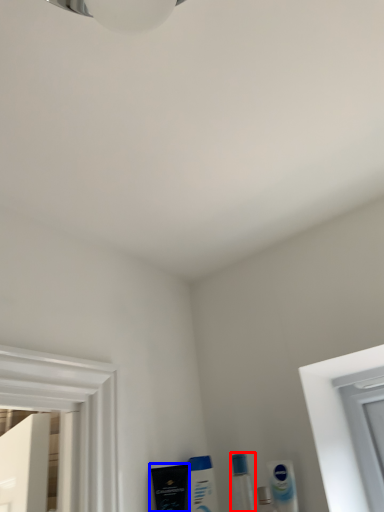
Question: Which object appears farthest to the camera in this image, toiletry (highlighted by a red box) or mouthwash (highlighted by a blue box)?

Choices:
 (A) toiletry
 (B) mouthwash

Answer: (B)